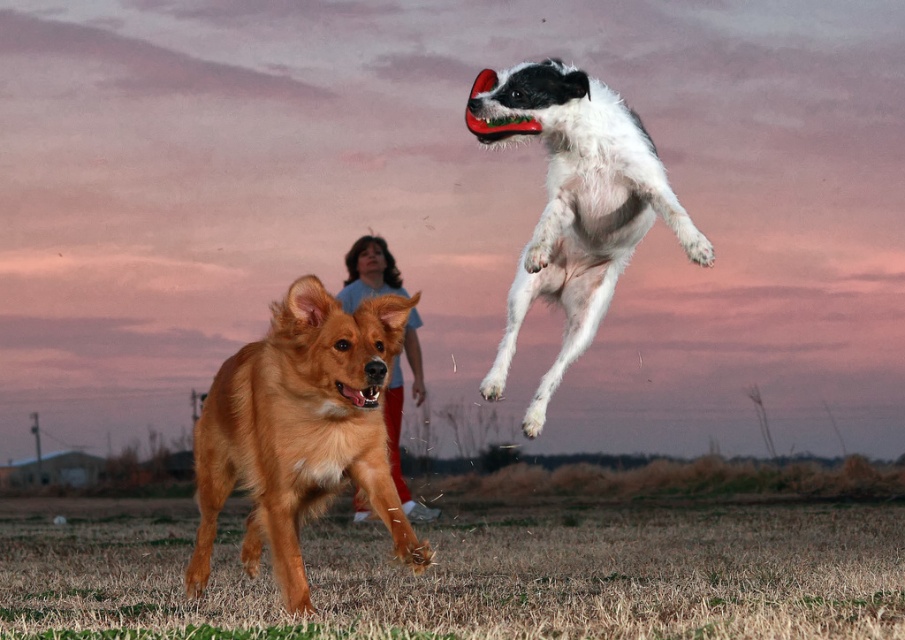
Is white fur dog at upper right to the right of light blue t-shirt at center from the viewer's perspective?

Yes, white fur dog at upper right is to the right of light blue t-shirt at center.

At what (x,y) coordinates should I click in order to perform the action: click on white fur dog at upper right. Please return your answer as a coordinate pair (x, y). Image resolution: width=905 pixels, height=640 pixels. Looking at the image, I should click on (574, 204).

Is golden fur dog at center above light blue t-shirt at center?

Actually, golden fur dog at center is below light blue t-shirt at center.

Is golden fur dog at center taller than light blue t-shirt at center?

Indeed, golden fur dog at center has a greater height compared to light blue t-shirt at center.

Which is in front, point (395, 512) or point (356, 243)?

Point (395, 512)

At what (x,y) coordinates should I click in order to perform the action: click on golden fur dog at center. Please return your answer as a coordinate pair (x, y). The image size is (905, 640). Looking at the image, I should click on (300, 432).

Does golden fur dog at center appear on the right side of white fur dog at upper right?

In fact, golden fur dog at center is to the left of white fur dog at upper right.

Which is more to the right, golden fur dog at center or white fur dog at upper right?

From the viewer's perspective, white fur dog at upper right appears more on the right side.

Image resolution: width=905 pixels, height=640 pixels. I want to click on golden fur dog at center, so click(x=300, y=432).